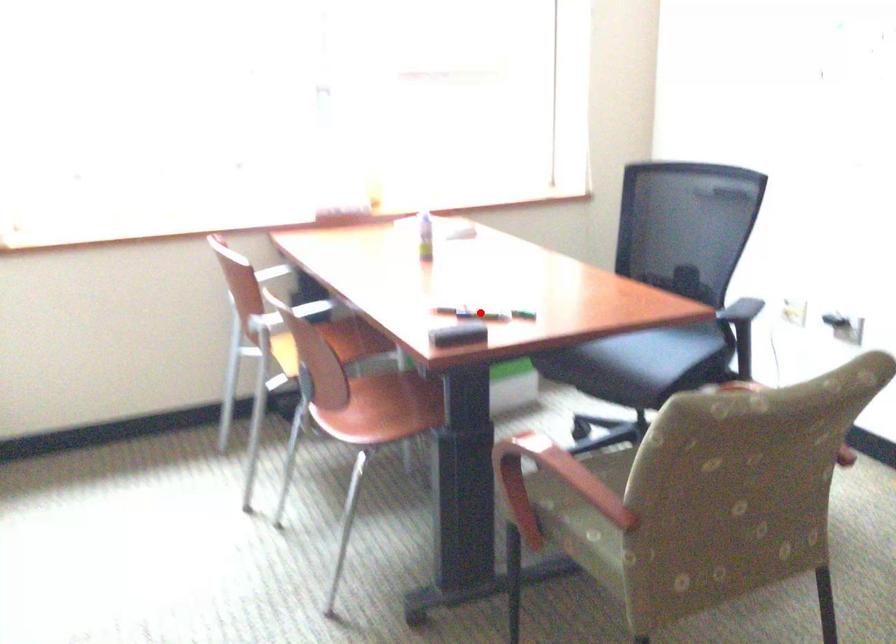
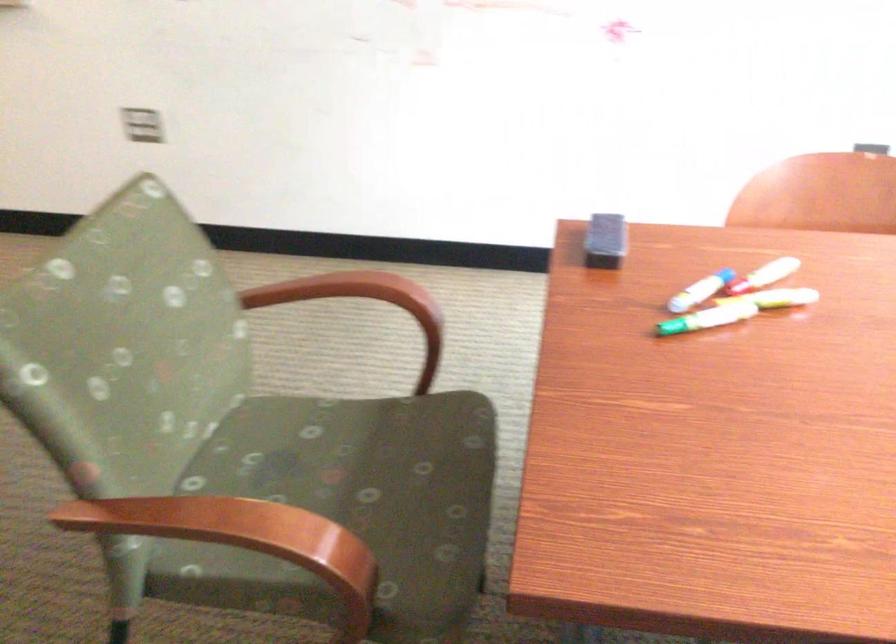
Question: I am providing you with two images of the same scene from different viewpoints. Given a red point in image1, look at the same physical point in image2. Is it:

Choices:
 (A) Closer to the viewpoint
 (B) Farther from the viewpoint

Answer: (A)